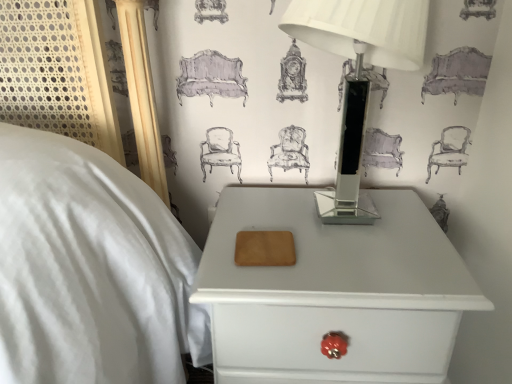
At what (x,y) coordinates should I click in order to perform the action: click on free space to the left of clear glass table lamp at upper right. Please return your answer as a coordinate pair (x, y). This screenshot has width=512, height=384. Looking at the image, I should click on (246, 221).